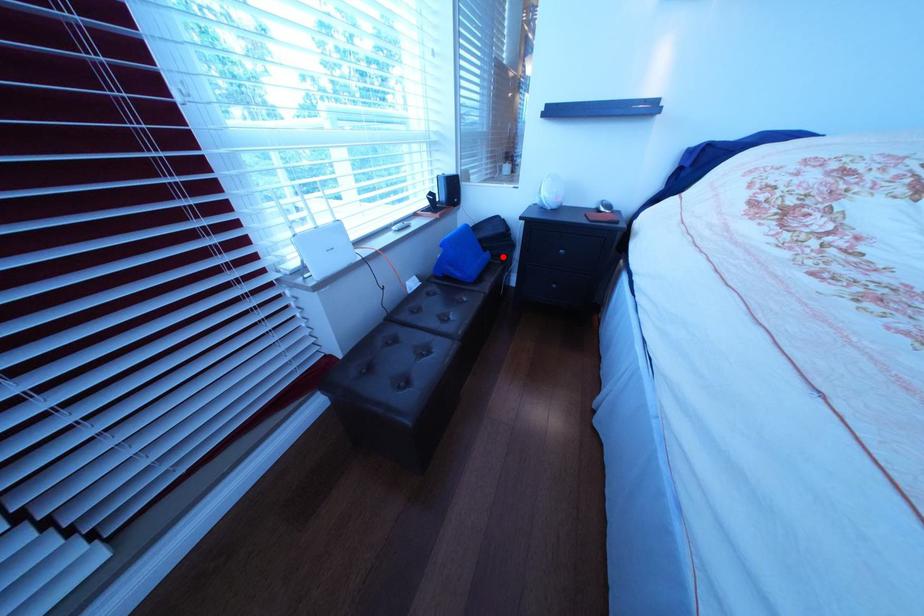
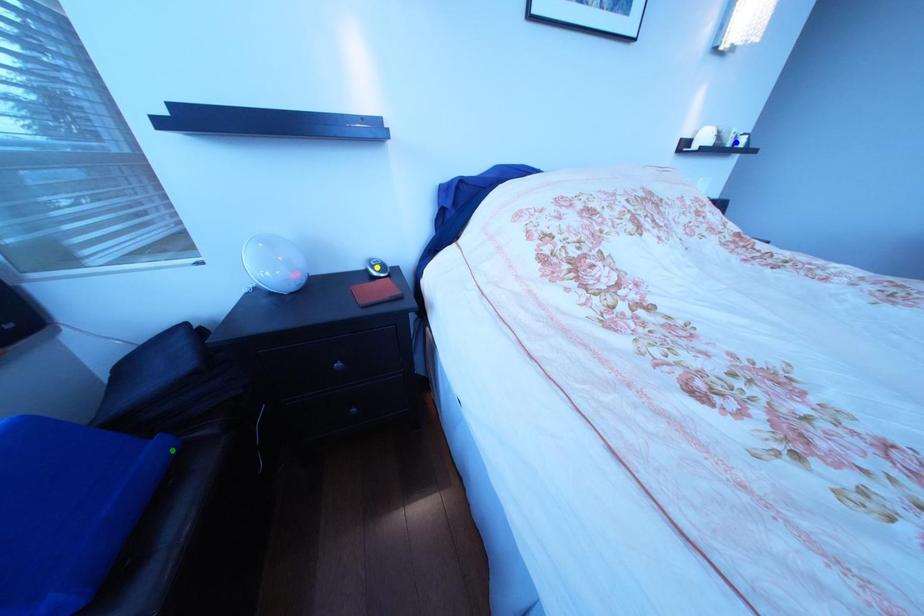
Question: I am providing you with two images of the same scene from different viewpoints. A red point is marked on the first image. You are given multiple points on the second image. Which point in image 2 represents the same 3d spot as the red point in image 1?

Choices:
 (A) blue point
 (B) yellow point
 (C) green point

Answer: (C)